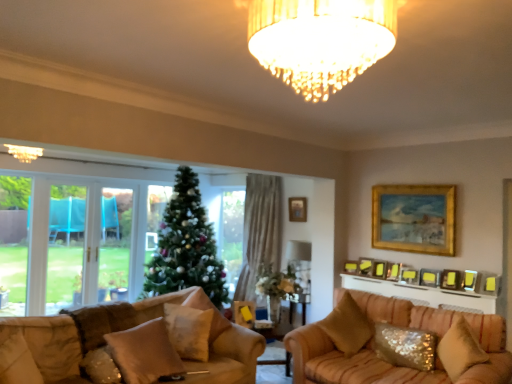
Question: From a real-world perspective, is gold-framed picture at upper center, positioned as the 8th picture frame in front-to-back order, above or below white sequined pillow at center, the fifth pillow viewed from the right?

Choices:
 (A) below
 (B) above

Answer: (B)

Question: Considering the positions of gold-framed picture at upper center, positioned as the 8th picture frame in front-to-back order, and white sequined pillow at center, the fifth pillow viewed from the right, in the image, is gold-framed picture at upper center, positioned as the 8th picture frame in front-to-back order, bigger or smaller than white sequined pillow at center, the fifth pillow viewed from the right,?

Choices:
 (A) big
 (B) small

Answer: (B)

Question: Which is nearer to the matte gold picture frame at upper right, which appears as the sixth picture frame when viewed from the front?

Choices:
 (A) matte white lampshade at center
 (B) sparkly gold pillow at lower right, the 1th pillow from the right
 (C) wooden picture frame at upper right, which is the 8th picture frame in back-to-front order
 (D) gold metallic picture frame at right, marked as the 7th picture frame in a front-to-back arrangement
 (E) gold-framed picture at upper center, marked as the fourth picture frame in a front-to-back arrangement

Answer: (D)

Question: Considering the real-world distances, which object is farthest from the matte gold chandelier at upper center, acting as the 2th light fixture starting from the front?

Choices:
 (A) sparkly gold pillow at lower right, acting as the 8th pillow starting from the left
 (B) gold-framed painting at upper right, which is the 7th picture frame from back to front
 (C) gold-framed picture at upper center, positioned as the 8th picture frame in front-to-back order
 (D) velvet beige pillow at center, the 4th pillow in the right-to-left sequence
 (E) white sequined pillow at center, which is counted as the fourth pillow, starting from the left

Answer: (B)